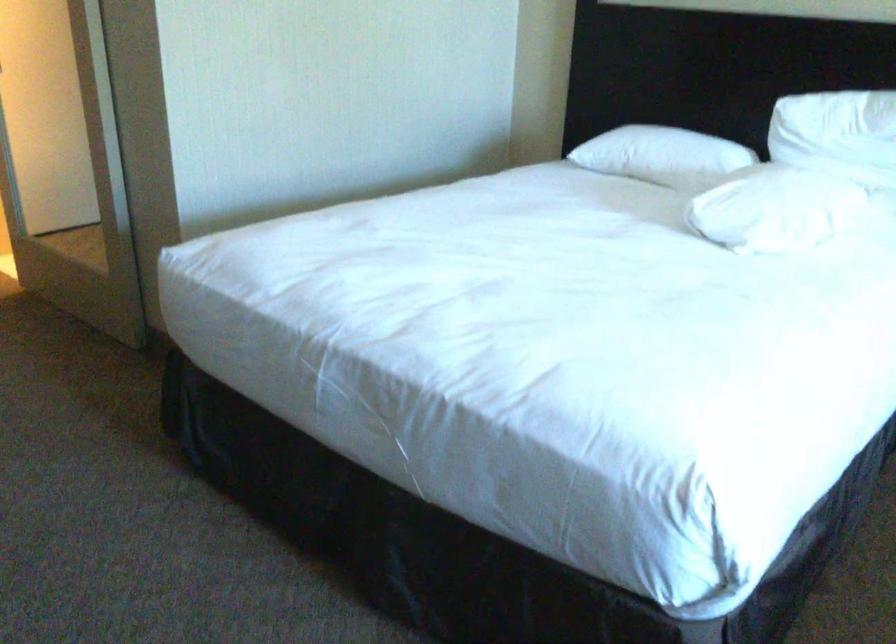
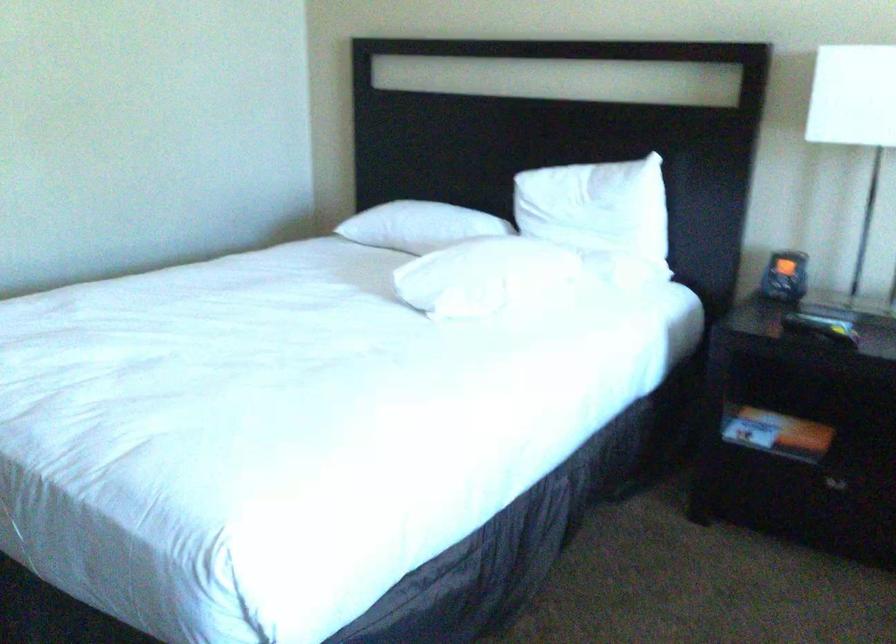
Locate, in the second image, the point that corresponds to the point at 668,147 in the first image.

(419, 225)